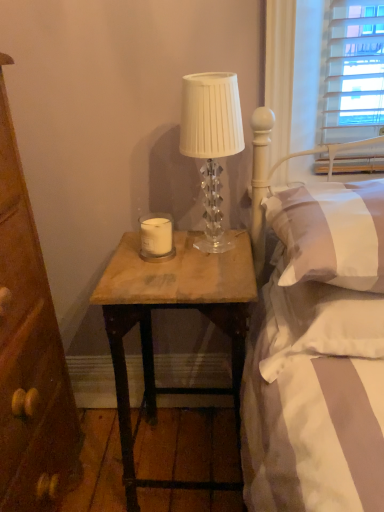
Image resolution: width=384 pixels, height=512 pixels. In order to click on vacant space underneath wooden table at center (from a real-world perspective) in this screenshot , I will do `click(188, 453)`.